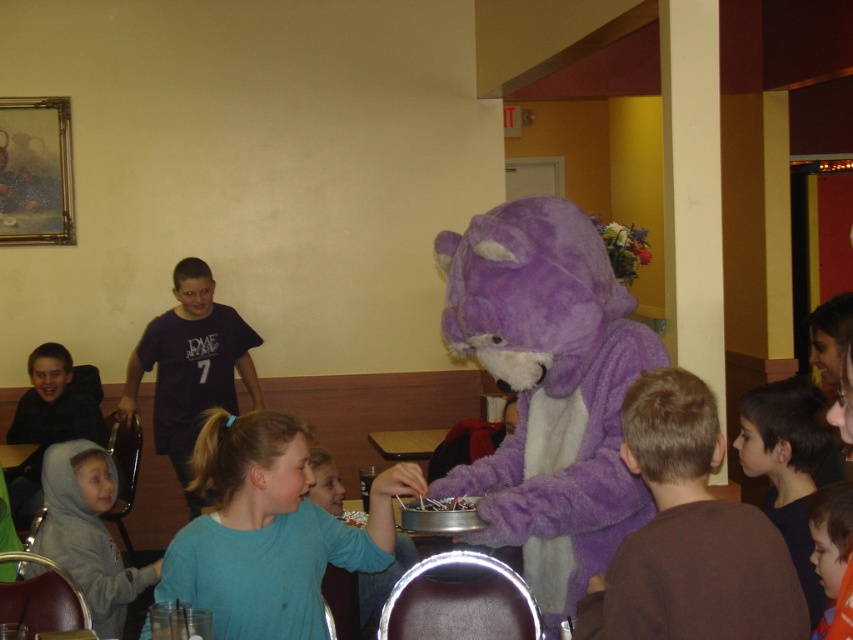
You are a photographer taking a picture of the dark brown hair at lower right and the light blue shirt at center. Which object should you focus on first if you want to capture both in the same frame without moving the camera?

The dark brown hair at lower right is bigger than the light blue shirt at center, so you should focus on the dark brown hair at lower right first to ensure it is in sharp focus before adjusting for the smaller light blue shirt at center.

You are a photographer trying to capture a photo of the purple fuzzy costume at center and the gray fleece hoodie at lower left. From the photographer perspective, which object is on the right side?

The gray fleece hoodie at lower left is on the right side because the purple fuzzy costume at center is positioned on the left side of it.